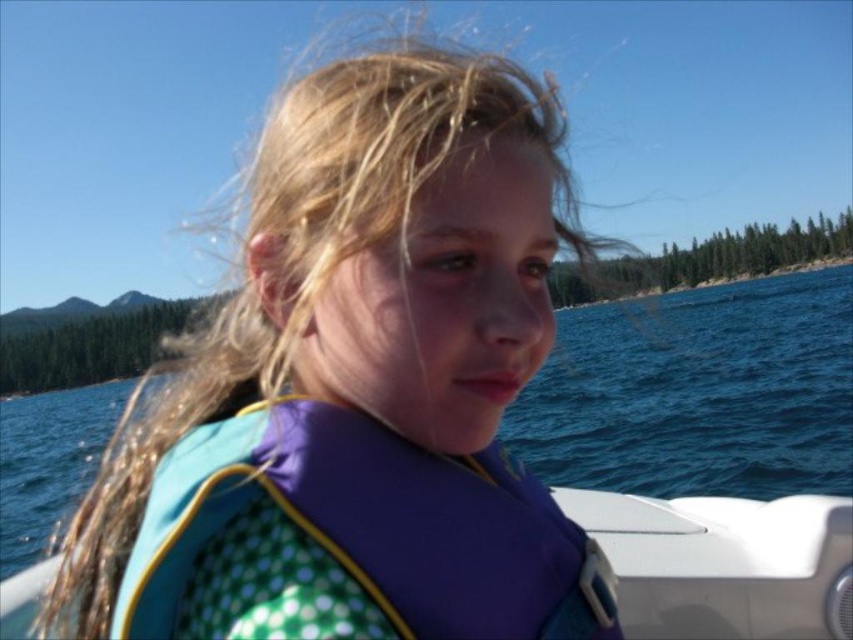
Can you confirm if blue polka dot life vest at center is positioned below blue water at center?

No, blue polka dot life vest at center is not below blue water at center.

Does point (492, 484) lie behind point (28, 438)?

No, (492, 484) is in front of (28, 438).

The width and height of the screenshot is (853, 640). Find the location of `blue polka dot life vest at center`. blue polka dot life vest at center is located at coordinates (368, 365).

You are a GUI agent. You are given a task and a screenshot of the screen. Output one action in this format:
    pyautogui.click(x=<x>, y=<y>)
    Task: Click on the polka dot fabric life jacket at center
    Image resolution: width=853 pixels, height=640 pixels.
    Given the screenshot: What is the action you would take?
    pyautogui.click(x=352, y=540)

Between point (265, 492) and point (759, 496), which one is positioned behind?

Point (759, 496)

Image resolution: width=853 pixels, height=640 pixels. Identify the location of polka dot fabric life jacket at center. (352, 540).

The height and width of the screenshot is (640, 853). What do you see at coordinates (368, 365) in the screenshot?
I see `blue polka dot life vest at center` at bounding box center [368, 365].

Locate an element on the screen. This screenshot has width=853, height=640. blue polka dot life vest at center is located at coordinates (368, 365).

The image size is (853, 640). Find the location of `blue polka dot life vest at center`. blue polka dot life vest at center is located at coordinates (368, 365).